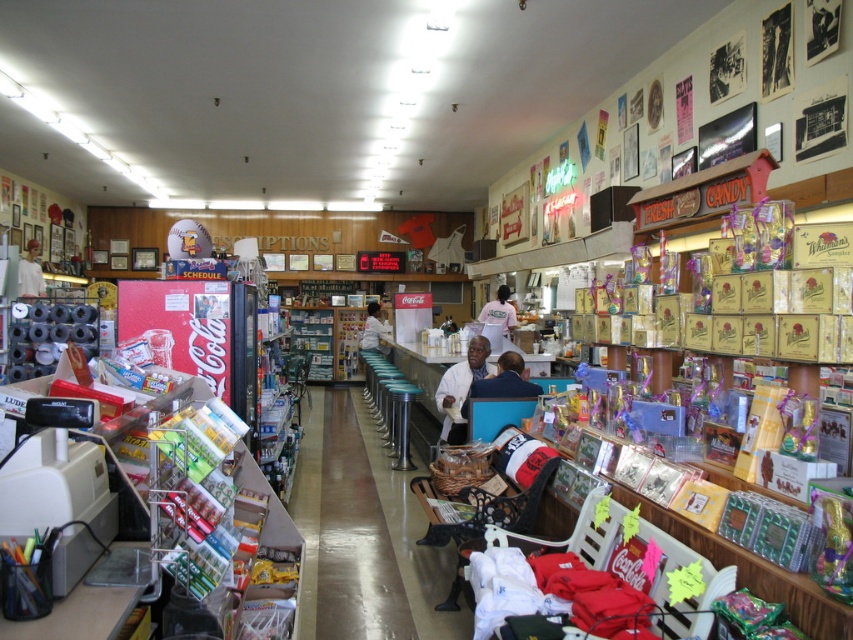
Who is taller, white matte shirt at center or white fabric shirt at left?

With more height is white matte shirt at center.

Is white matte shirt at center closer to the viewer compared to white fabric shirt at left?

Yes, it is in front of white fabric shirt at left.

Is point (479, 362) more distant than point (35, 296)?

That is False.

At what (x,y) coordinates should I click in order to perform the action: click on white matte shirt at center. Please return your answer as a coordinate pair (x, y). Looking at the image, I should click on click(x=460, y=388).

Which of these two, white fabric shirt at left or white cotton shirt at center, stands taller?

Standing taller between the two is white cotton shirt at center.

Does white fabric shirt at left have a smaller size compared to white cotton shirt at center?

Indeed, white fabric shirt at left has a smaller size compared to white cotton shirt at center.

Is point (44, 289) positioned in front of point (503, 310)?

Yes, point (44, 289) is closer to viewer.

Locate an element on the screen. This screenshot has height=640, width=853. white fabric shirt at left is located at coordinates (30, 273).

Between white fabric shirt at left and white fabric shirt at center, which one appears on the right side from the viewer's perspective?

white fabric shirt at center is more to the right.

Describe the element at coordinates (30, 273) in the screenshot. I see `white fabric shirt at left` at that location.

Does point (18, 285) come behind point (375, 314)?

No.

The width and height of the screenshot is (853, 640). I want to click on white fabric shirt at left, so click(30, 273).